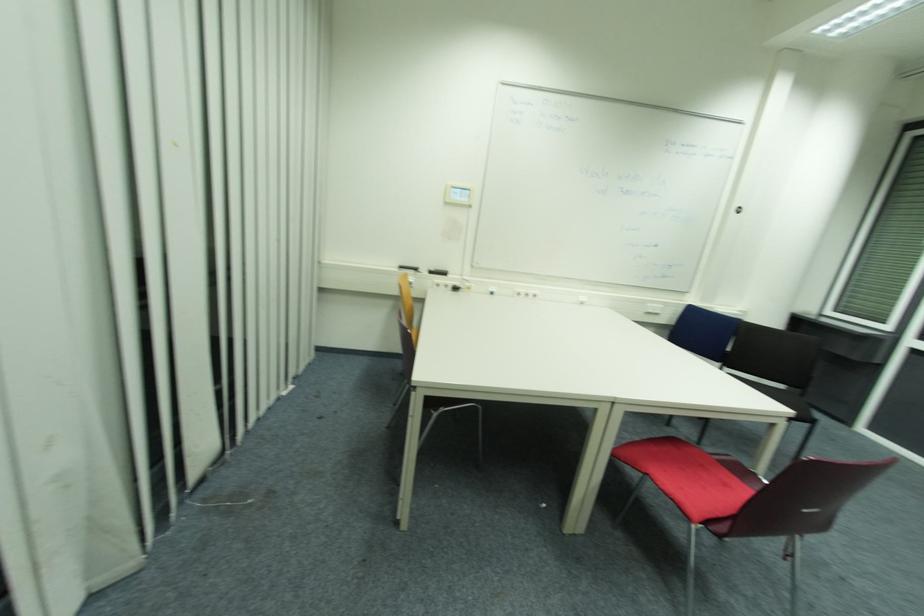
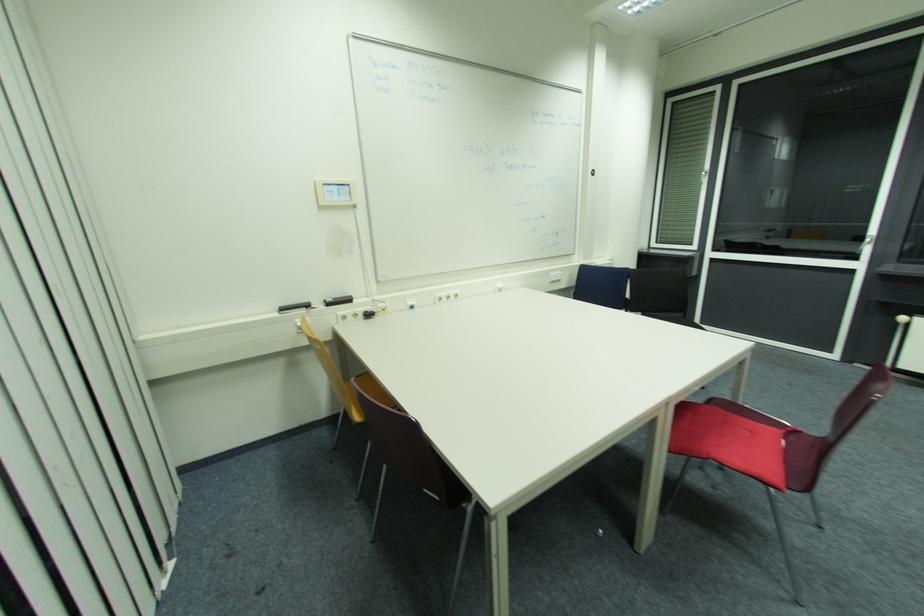
Question: How did the camera likely rotate?

Choices:
 (A) Left
 (B) Right
 (C) Up
 (D) Down

Answer: (B)